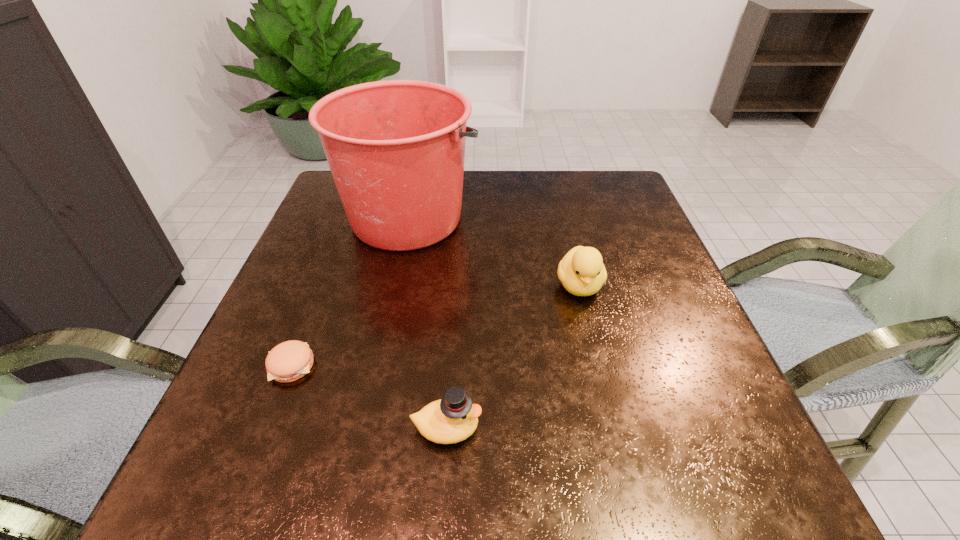
Locate an element on the screen. The height and width of the screenshot is (540, 960). free space located on the front-facing side of the nearer duck is located at coordinates (692, 428).

Where is `free point located 0.130m on the right of the patty`? free point located 0.130m on the right of the patty is located at coordinates pos(388,366).

Where is `object located at the far edge`? This screenshot has width=960, height=540. object located at the far edge is located at coordinates [x=396, y=148].

Locate an element on the screen. object that is at the near edge is located at coordinates (454, 418).

Identify the location of bucket that is at the left edge. The width and height of the screenshot is (960, 540). (396, 148).

This screenshot has height=540, width=960. Identify the location of patty that is at the left edge. (289, 361).

At what (x,y) coordinates should I click in order to perform the action: click on object that is positioned at the right edge. Please return your answer as a coordinate pair (x, y). This screenshot has height=540, width=960. Looking at the image, I should click on point(582,272).

What are the coordinates of `object that is at the far left corner` in the screenshot? It's located at (396, 148).

Locate an element on the screen. vacant space at the far edge of the desktop is located at coordinates (566, 216).

In the image, there is a desktop. Identify the location of free space at the near edge. (613, 473).